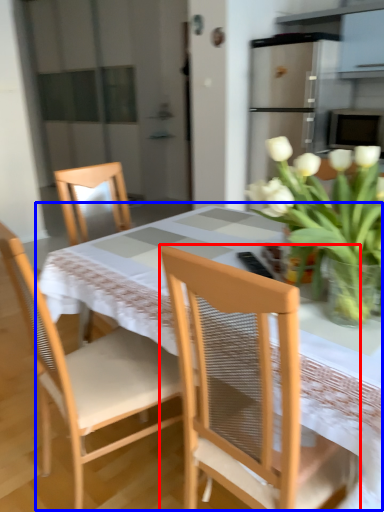
Question: Which point is closer to the camera, chair (highlighted by a red box) or kitchen & dining room table (highlighted by a blue box)?

Choices:
 (A) chair
 (B) kitchen & dining room table

Answer: (A)